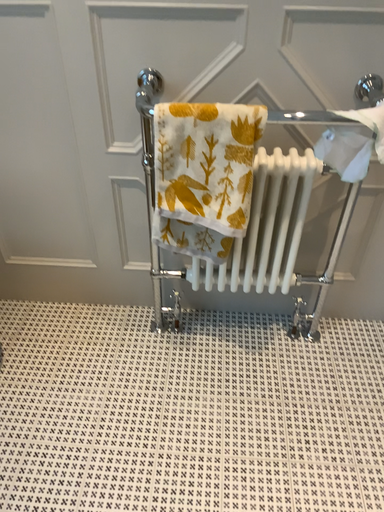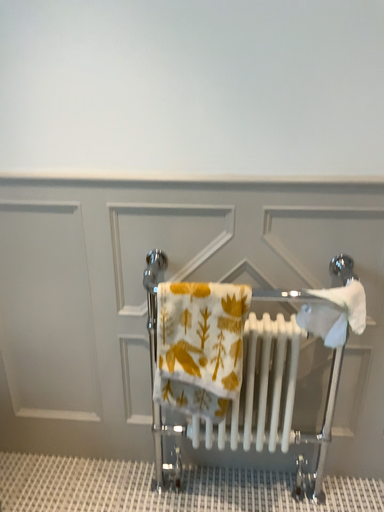
Question: How did the camera likely rotate when shooting the video?

Choices:
 (A) rotated upward
 (B) rotated downward

Answer: (A)